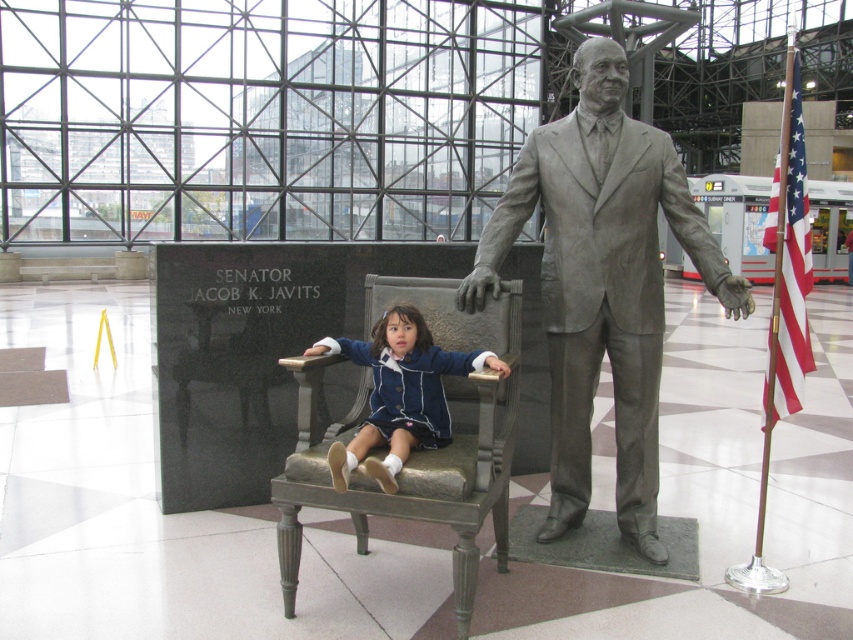
From the picture: Is the position of bronze/golden-brown armchair at center more distant than that of blue fabric dress at center?

No, bronze/golden-brown armchair at center is in front of blue fabric dress at center.

Describe the element at coordinates (416, 451) in the screenshot. I see `bronze/golden-brown armchair at center` at that location.

You are a GUI agent. You are given a task and a screenshot of the screen. Output one action in this format:
    pyautogui.click(x=<x>, y=<y>)
    Task: Click on the bronze/golden-brown armchair at center
    The width and height of the screenshot is (853, 640).
    Given the screenshot: What is the action you would take?
    pyautogui.click(x=416, y=451)

Can you confirm if gray polished statue at center is smaller than bronze/golden-brown armchair at center?

Incorrect, gray polished statue at center is not smaller in size than bronze/golden-brown armchair at center.

Between gray polished statue at center and bronze/golden-brown armchair at center, which one is positioned higher?

gray polished statue at center

Between point (563, 173) and point (503, 380), which one is positioned in front?

Positioned in front is point (503, 380).

You are a GUI agent. You are given a task and a screenshot of the screen. Output one action in this format:
    pyautogui.click(x=<x>, y=<y>)
    Task: Click on the gray polished statue at center
    Image resolution: width=853 pixels, height=640 pixels.
    Given the screenshot: What is the action you would take?
    pyautogui.click(x=602, y=284)

Can you confirm if gray polished statue at center is bigger than blue fabric dress at center?

Yes, gray polished statue at center is bigger than blue fabric dress at center.

From the picture: Does gray polished statue at center have a smaller size compared to blue fabric dress at center?

No.

Who is more distant from viewer, (605, 285) or (350, 458)?

Point (605, 285)

This screenshot has width=853, height=640. Find the location of `gray polished statue at center`. gray polished statue at center is located at coordinates point(602,284).